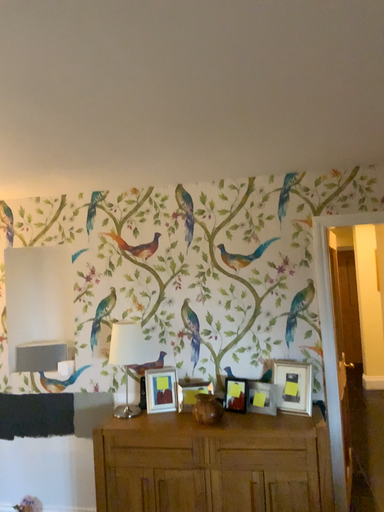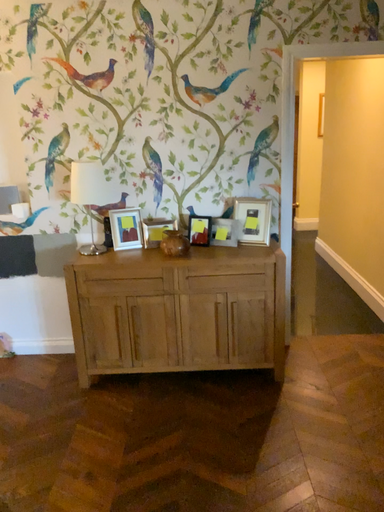
Question: Which way did the camera rotate in the video?

Choices:
 (A) rotated left
 (B) rotated right

Answer: (B)